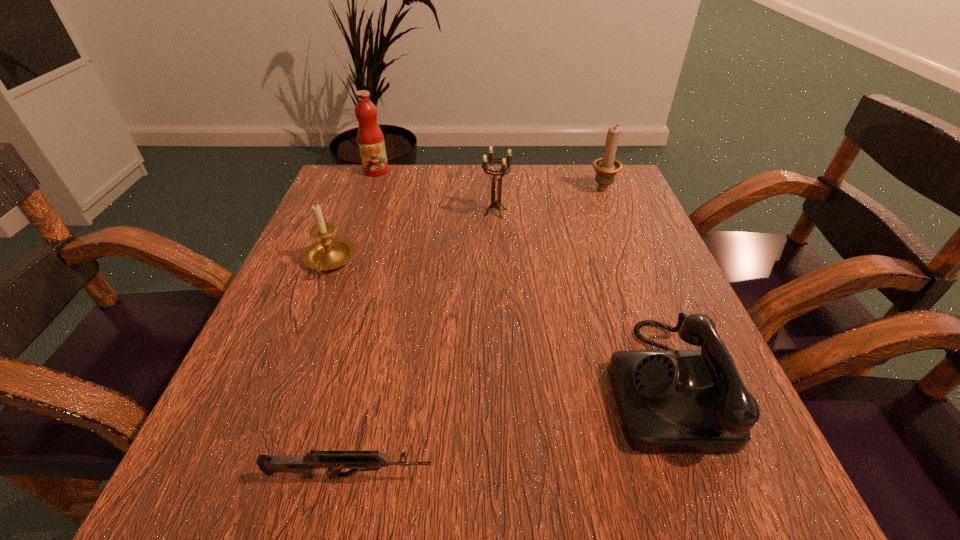
In the image, there is a desktop. Identify the location of vacant space at the far edge. (523, 212).

Find the location of a particular element. This screenshot has width=960, height=540. vacant space at the near edge of the desktop is located at coordinates (413, 454).

You are a GUI agent. You are given a task and a screenshot of the screen. Output one action in this format:
    pyautogui.click(x=<x>, y=<y>)
    Task: Click on the vacant region at the left edge
    
    Given the screenshot: What is the action you would take?
    (299, 356)

The image size is (960, 540). In the image, there is a desktop. Identify the location of vacant space at the right edge. (626, 235).

Find the location of a particular element. The image size is (960, 540). free space at the near left corner is located at coordinates pos(239,464).

In the image, there is a desktop. Where is `vacant space at the far right corner`? vacant space at the far right corner is located at coordinates (618, 214).

Where is `vacant space in between the farthest object and the fifth farthest object`? vacant space in between the farthest object and the fifth farthest object is located at coordinates (519, 277).

Where is `vacant area that lies between the rightmost candle holder and the second candle holder from left to right`? This screenshot has height=540, width=960. vacant area that lies between the rightmost candle holder and the second candle holder from left to right is located at coordinates click(x=549, y=199).

The height and width of the screenshot is (540, 960). In order to click on vacant region between the nearest candle holder and the tallest object in this screenshot , I will do `click(353, 216)`.

The width and height of the screenshot is (960, 540). I want to click on free space between the second farthest object and the nearest object, so click(x=476, y=332).